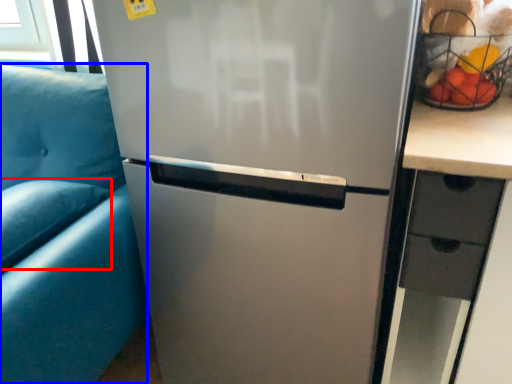
Question: Which point is closer to the camera, pillow (highlighted by a red box) or armchair (highlighted by a blue box)?

Choices:
 (A) pillow
 (B) armchair

Answer: (B)